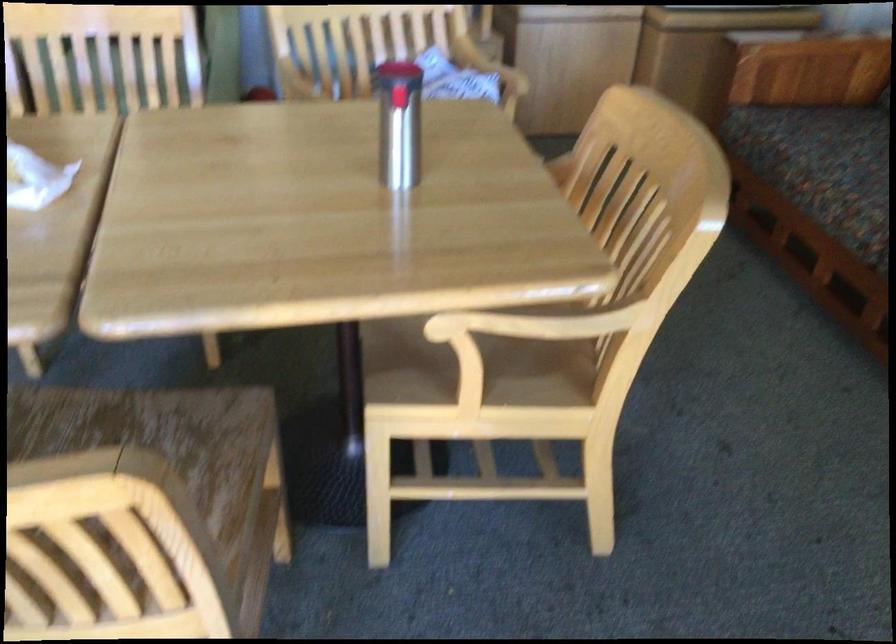
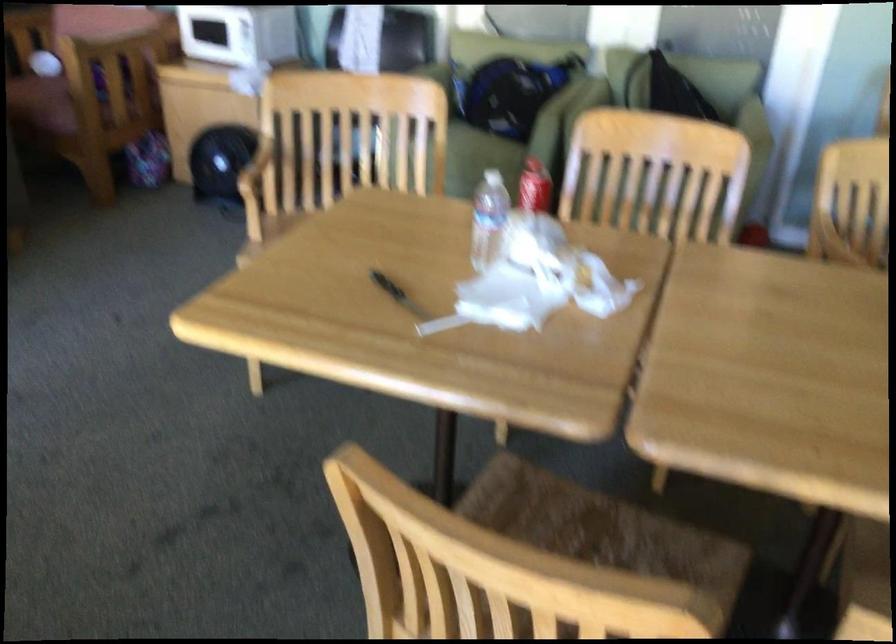
Question: The first image is from the beginning of the video and the second image is from the end. How did the camera likely rotate when shooting the video?

Choices:
 (A) Left
 (B) Right
 (C) Up
 (D) Down

Answer: (A)